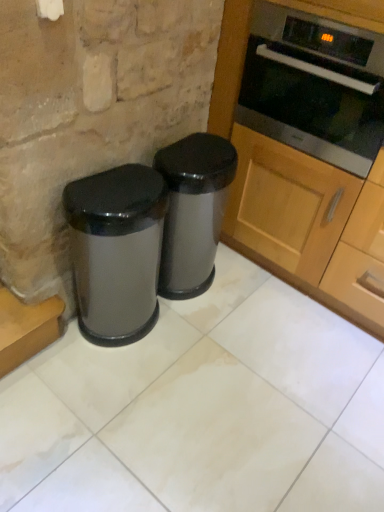
Question: Do you think satin silver trash can at center, which is the first waste container in right-to-left order, is within glossy metallic trash can at lower left, marked as the first waste container in a left-to-right arrangement, or outside of it?

Choices:
 (A) outside
 (B) inside

Answer: (A)

Question: In terms of width, does satin silver trash can at center, the second waste container viewed from the left, look wider or thinner when compared to glossy metallic trash can at lower left, marked as the first waste container in a left-to-right arrangement?

Choices:
 (A) thin
 (B) wide

Answer: (B)

Question: Considering the real-world distances, which object is closest to the glossy metallic trash can at lower left, marked as the first waste container in a left-to-right arrangement?

Choices:
 (A) satin silver trash can at center, which is the first waste container in right-to-left order
 (B) wooden cabinet at right
 (C) stainless steel oven at upper right

Answer: (A)

Question: Based on their relative distances, which object is nearer to the glossy metallic trash can at lower left, marked as the first waste container in a left-to-right arrangement?

Choices:
 (A) wooden cabinet at right
 (B) satin silver trash can at center, which is the first waste container in right-to-left order
 (C) stainless steel oven at upper right

Answer: (B)